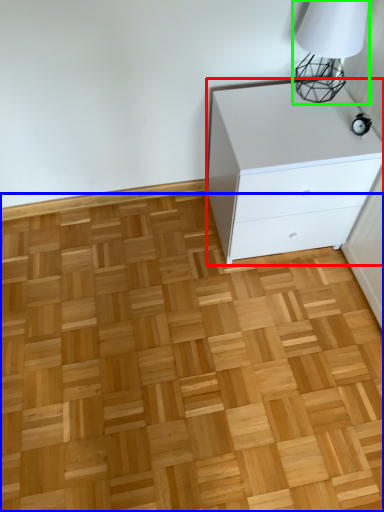
Question: Which is farther away from chest of drawers (highlighted by a red box)? hardwood (highlighted by a blue box) or table lamp (highlighted by a green box)?

Choices:
 (A) hardwood
 (B) table lamp

Answer: (A)